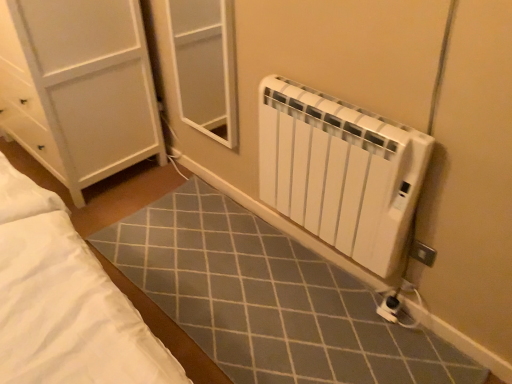
Question: From a real-world perspective, is white plastic electric outlet at lower right positioned above or below white plastic radiator at lower right?

Choices:
 (A) below
 (B) above

Answer: (A)

Question: Considering the positions of white plastic electric outlet at lower right and white plastic radiator at lower right in the image, is white plastic electric outlet at lower right taller or shorter than white plastic radiator at lower right?

Choices:
 (A) tall
 (B) short

Answer: (B)

Question: Is white plastic electric outlet at lower right wider or thinner than white plastic radiator at lower right?

Choices:
 (A) wide
 (B) thin

Answer: (B)

Question: Do you think white plastic radiator at lower right is within white plastic electric outlet at lower right, or outside of it?

Choices:
 (A) outside
 (B) inside

Answer: (A)

Question: Based on their sizes in the image, would you say white plastic radiator at lower right is bigger or smaller than white plastic electric outlet at lower right?

Choices:
 (A) small
 (B) big

Answer: (B)

Question: From the image's perspective, is white plastic radiator at lower right above or below white plastic electric outlet at lower right?

Choices:
 (A) below
 (B) above

Answer: (B)

Question: From a real-world perspective, is white plastic radiator at lower right above or below white plastic electric outlet at lower right?

Choices:
 (A) above
 (B) below

Answer: (A)